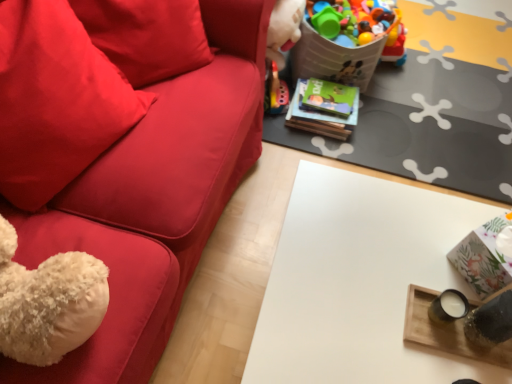
Question: Considering the positions of velvety red pillow at left and white glossy table at center in the image, is velvety red pillow at left taller or shorter than white glossy table at center?

Choices:
 (A) short
 (B) tall

Answer: (A)

Question: Which is correct: velvety red pillow at left is inside white glossy table at center, or outside of it?

Choices:
 (A) outside
 (B) inside

Answer: (A)

Question: From the image's perspective, is velvety red pillow at left positioned above or below white glossy table at center?

Choices:
 (A) below
 (B) above

Answer: (B)

Question: From the image's perspective, is white glossy table at center positioned above or below velvety red pillow at left?

Choices:
 (A) below
 (B) above

Answer: (A)

Question: Is white glossy table at center bigger or smaller than velvety red pillow at left?

Choices:
 (A) big
 (B) small

Answer: (A)

Question: Considering the positions of point (330, 226) and point (8, 102), is point (330, 226) closer or farther from the camera than point (8, 102)?

Choices:
 (A) closer
 (B) farther

Answer: (B)

Question: Looking at their shapes, would you say white glossy table at center is wider or thinner than velvety red pillow at left?

Choices:
 (A) thin
 (B) wide

Answer: (B)